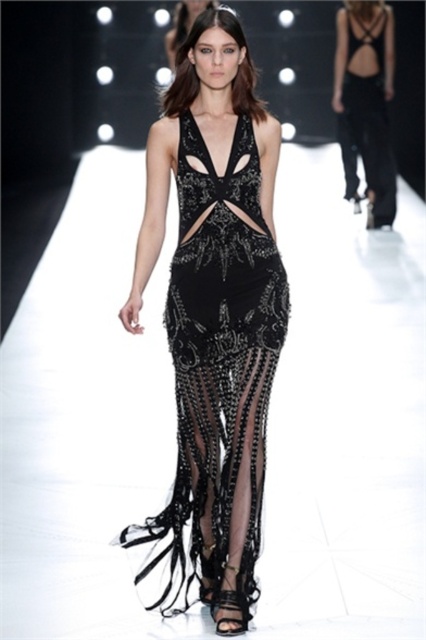
You are a photographer positioned at the front of the runway. You want to capture a closeup shot of the black sheer dress at center. Based on its position, where should you aim your camera? Please provide coordinates in the format of x,y between 0 and 1.

The black sheer dress at center is located at coordinates point (365, 100). Therefore, you should aim your camera at the coordinates (365, 100) to capture the closeup shot.

You are a photographer at the runway show and need to decide which dress to focus on for a closeup shot. Since both the black sheer dress at center and the satin black dress at center are in the frame, which dress is wider so that it can be better highlighted in the photo?

The black sheer dress at center is wider than the satin black dress at center, so it can be better highlighted in the photo.